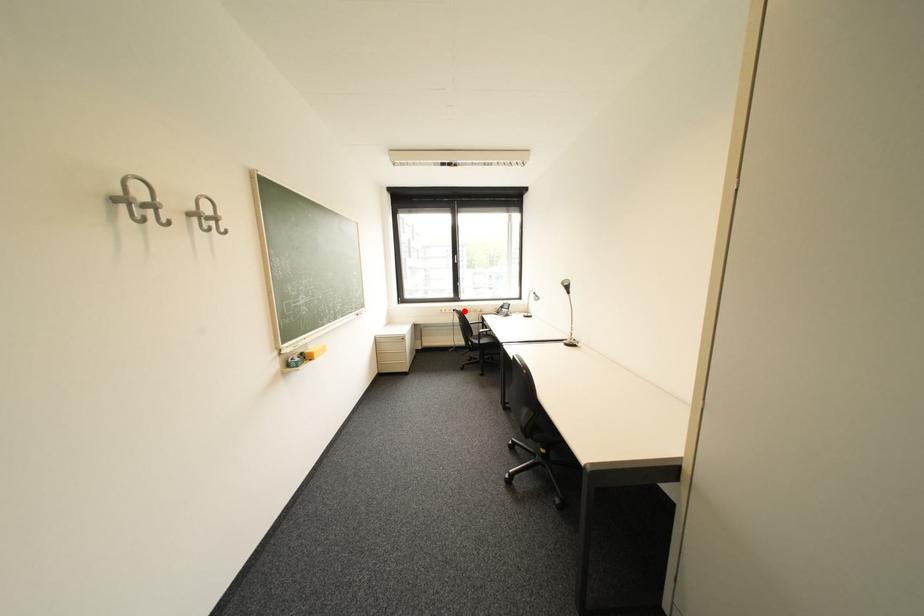
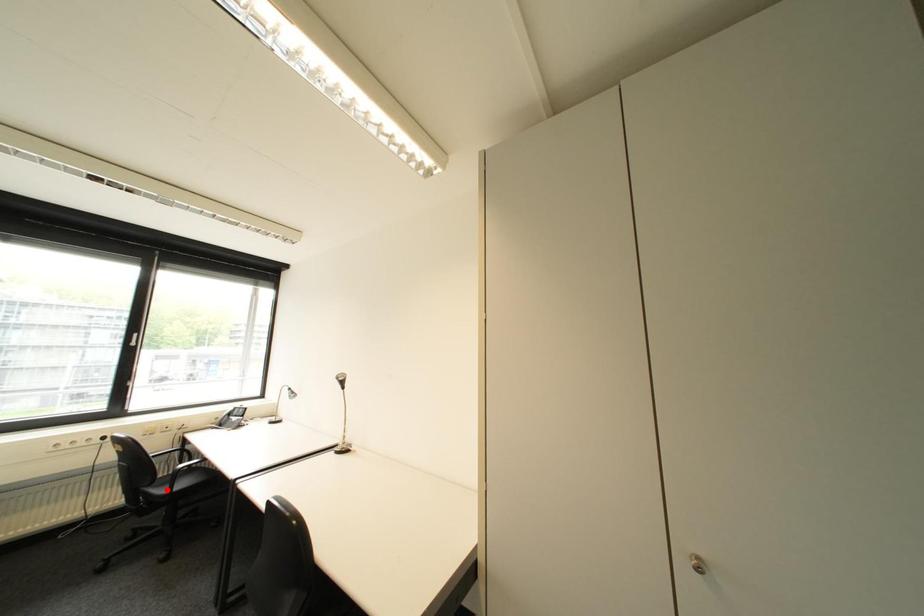
I am providing you with two images of the same scene from different viewpoints. A red point is marked on the first image and another point is marked on the second image. Does the point marked in image1 correspond to the same location as the one in image2?

No